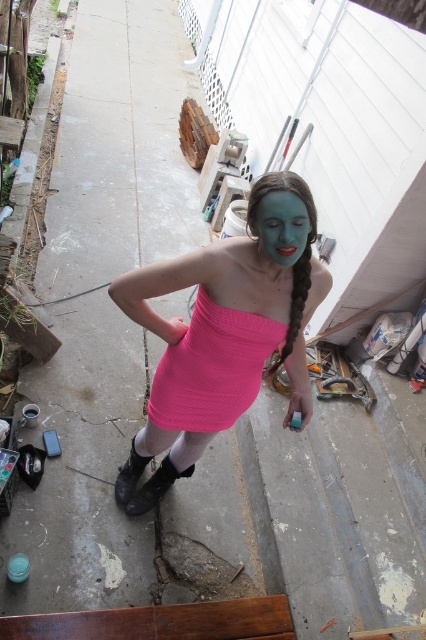
You are an artist observing the scene. You notice the blue matte face at center and the blue matte pigtail at center. Which object is located to the left of the other?

The blue matte face at center is positioned on the left side of blue matte pigtail at center.

You are a photographer trying to capture the perfect shot of the person in the bright pink dress. You notice two points marked in the scene. From your position behind the camera, which point is closer to you? The points are labeled as point 1 at coordinates point [288,234] and point 2 at coordinates point [308,275]. Please answer based on the spatial relationship between them.

Point 1 at coordinates point [288,234] is closer to you because it is in front of point 2 at coordinates point [308,275].

You are a photographer setting up a shoot in the described scene. You need to place a prop at the exact center coordinates of the image, which is at point 0.5, 0.5. Where should you position the prop relative to the pink ribbed dress at center?

The pink ribbed dress at center is located at coordinates (212, 369), which is slightly to the right and slightly below the exact center point (213, 320) of the image. To place the prop at the exact center, position it slightly to the left and slightly above the pink ribbed dress at center.